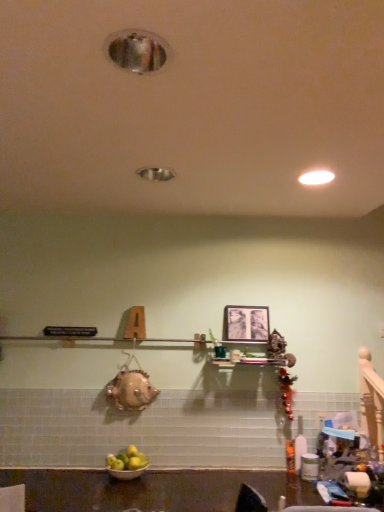
Describe the element at coordinates (316, 177) in the screenshot. The width and height of the screenshot is (384, 512). I see `white glossy light fixture at upper right` at that location.

I want to click on green matte apples at lower center, so click(127, 460).

Locate an element on the screen. white glossy light fixture at upper right is located at coordinates (316, 177).

Is green matte apples at lower center oriented away from matte black picture frame at center?

No, green matte apples at lower center is not facing away from matte black picture frame at center.

From the image's perspective, relative to matte black picture frame at center, is green matte apples at lower center above or below?

Based on their image positions, green matte apples at lower center is located beneath matte black picture frame at center.

Which of these two, green matte apples at lower center or matte black picture frame at center, is wider?

With larger width is green matte apples at lower center.

How different are the orientations of white glossy light fixture at upper right and white glossy bowl at lower center in degrees?

white glossy light fixture at upper right and white glossy bowl at lower center are facing 0.000834 degrees away from each other.

Can you confirm if white glossy light fixture at upper right is positioned to the right of white glossy bowl at lower center?

Indeed, white glossy light fixture at upper right is positioned on the right side of white glossy bowl at lower center.

Could white glossy bowl at lower center be considered to be inside white glossy light fixture at upper right?

No, white glossy bowl at lower center is not a part of white glossy light fixture at upper right.

Which is in front, white glossy light fixture at upper right or white glossy bowl at lower center?

white glossy light fixture at upper right.

From the image's perspective, between white glossy light fixture at upper right and green matte apples at lower center, which one is located above?

white glossy light fixture at upper right is shown above in the image.

From a real-world perspective, relative to green matte apples at lower center, is white glossy light fixture at upper right vertically above or below?

Clearly, from a real-world perspective, white glossy light fixture at upper right is above green matte apples at lower center.

Does point (320, 184) come in front of point (118, 464)?

Yes, point (320, 184) is closer to viewer.

Is green matte apples at lower center a part of white glossy light fixture at upper right?

Actually, green matte apples at lower center is outside white glossy light fixture at upper right.

Is matte black picture frame at center oriented away from white glossy light fixture at upper right?

No, matte black picture frame at center is not facing the opposite direction of white glossy light fixture at upper right.

Is matte black picture frame at center inside the boundaries of white glossy light fixture at upper right, or outside?

matte black picture frame at center is not enclosed by white glossy light fixture at upper right.

From a real-world perspective, between matte black picture frame at center and white glossy light fixture at upper right, who is vertically higher?

white glossy light fixture at upper right is physically above.

How many degrees apart are the facing directions of matte black picture frame at center and white glossy light fixture at upper right?

There is a 1.13-degree angle between the facing directions of matte black picture frame at center and white glossy light fixture at upper right.

Which object is more forward, matte black picture frame at center or green matte apples at lower center?

Positioned in front is green matte apples at lower center.

Between matte black picture frame at center and green matte apples at lower center, which one appears on the right side from the viewer's perspective?

Positioned to the right is matte black picture frame at center.

From a real-world perspective, between matte black picture frame at center and green matte apples at lower center, who is vertically lower?

green matte apples at lower center, from a real-world perspective.

From the image's perspective, which is above, white glossy bowl at lower center or matte black picture frame at center?

From the image's view, matte black picture frame at center is above.

Is white glossy bowl at lower center in contact with matte black picture frame at center?

white glossy bowl at lower center is not next to matte black picture frame at center, and they're not touching.

From a real-world perspective, relative to matte black picture frame at center, is white glossy bowl at lower center vertically above or below?

white glossy bowl at lower center is below matte black picture frame at center.

Considering the sizes of white glossy bowl at lower center and matte black picture frame at center in the image, is white glossy bowl at lower center wider or thinner than matte black picture frame at center?

white glossy bowl at lower center is wider than matte black picture frame at center.

Consider the image. Choose the correct answer: Is white glossy light fixture at upper right inside matte black picture frame at center or outside it?

white glossy light fixture at upper right is located beyond the bounds of matte black picture frame at center.

Which of these two, white glossy light fixture at upper right or matte black picture frame at center, is thinner?

matte black picture frame at center is thinner.

From the image's perspective, is white glossy light fixture at upper right below matte black picture frame at center?

Incorrect, from the image's perspective, white glossy light fixture at upper right is higher than matte black picture frame at center.

What's the angular difference between white glossy light fixture at upper right and matte black picture frame at center's facing directions?

The facing directions of white glossy light fixture at upper right and matte black picture frame at center are 1.13 degrees apart.

Locate an element on the screen. This screenshot has height=512, width=384. picture frame above the green matte apples at lower center (from the image's perspective) is located at coordinates (246, 323).

Locate an element on the screen. lighting on the right of white glossy bowl at lower center is located at coordinates (316, 177).

Estimate the real-world distances between objects in this image. Which object is further from white glossy bowl at lower center, white glossy light fixture at upper right or green matte apples at lower center?

Among the two, white glossy light fixture at upper right is located further to white glossy bowl at lower center.

Consider the image. Based on their spatial positions, is white glossy light fixture at upper right or matte black picture frame at center further from white glossy bowl at lower center?

The object further to white glossy bowl at lower center is white glossy light fixture at upper right.

Considering their positions, is white glossy bowl at lower center positioned further to matte black picture frame at center than green matte apples at lower center?

white glossy bowl at lower center.

In the scene shown: When comparing their distances from green matte apples at lower center, does white glossy light fixture at upper right or white glossy bowl at lower center seem closer?

white glossy bowl at lower center is closer to green matte apples at lower center.

Estimate the real-world distances between objects in this image. Which object is further from matte black picture frame at center, white glossy light fixture at upper right or green matte apples at lower center?

white glossy light fixture at upper right is further to matte black picture frame at center.

Based on the photo, based on their spatial positions, is white glossy bowl at lower center or green matte apples at lower center closer to white glossy light fixture at upper right?

The object closer to white glossy light fixture at upper right is green matte apples at lower center.

Estimate the real-world distances between objects in this image. Which object is further from white glossy bowl at lower center, green matte apples at lower center or matte black picture frame at center?

Based on the image, matte black picture frame at center appears to be further to white glossy bowl at lower center.

Which object lies nearer to the anchor point white glossy light fixture at upper right, green matte apples at lower center or white glossy bowl at lower center?

green matte apples at lower center is closer to white glossy light fixture at upper right.

At what (x,y) coordinates should I click in order to perform the action: click on fruit between white glossy light fixture at upper right and white glossy bowl at lower center in the vertical direction. Please return your answer as a coordinate pair (x, y). This screenshot has height=512, width=384. Looking at the image, I should click on (127, 460).

Where is `picture frame between white glossy light fixture at upper right and white glossy bowl at lower center in the up-down direction`? This screenshot has height=512, width=384. picture frame between white glossy light fixture at upper right and white glossy bowl at lower center in the up-down direction is located at coordinates (246, 323).

This screenshot has height=512, width=384. I want to click on picture frame between white glossy light fixture at upper right and green matte apples at lower center in the up-down direction, so (x=246, y=323).

Where is `fruit between matte black picture frame at center and white glossy bowl at lower center from top to bottom`? fruit between matte black picture frame at center and white glossy bowl at lower center from top to bottom is located at coordinates (127, 460).